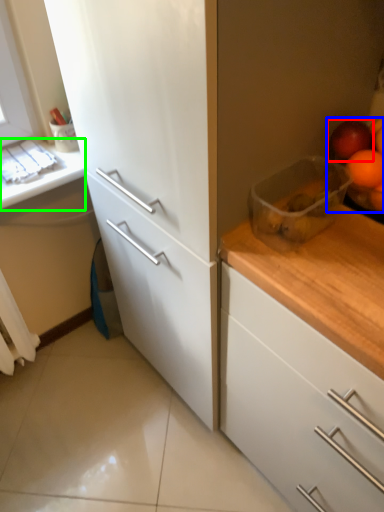
Question: Considering the real-world distances, which object is closest to apple (highlighted by a red box)? fruit (highlighted by a blue box) or counter top (highlighted by a green box).

Choices:
 (A) fruit
 (B) counter top

Answer: (A)